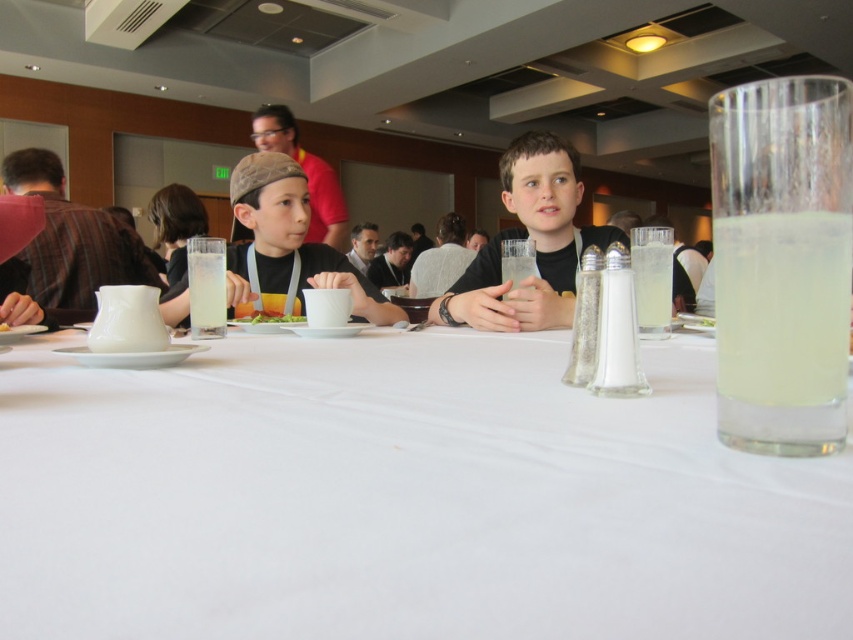
Does clear glass at center appear on the right side of green leafy salad at center?

Yes, clear glass at center is to the right of green leafy salad at center.

Is point (519, 243) farther from camera compared to point (276, 316)?

No, (519, 243) is in front of (276, 316).

Does point (514, 273) come in front of point (274, 320)?

Yes, point (514, 273) is in front of point (274, 320).

This screenshot has height=640, width=853. I want to click on clear glass at center, so click(517, 260).

Is clear glass at left to the right of green leafy salad at center from the viewer's perspective?

Incorrect, clear glass at left is not on the right side of green leafy salad at center.

The width and height of the screenshot is (853, 640). I want to click on clear glass at left, so click(x=206, y=294).

From the picture: Is clear glass at upper right thinner than clear glass at left?

Yes, clear glass at upper right is thinner than clear glass at left.

Between clear glass at upper right and clear glass at left, which one has more height?

clear glass at upper right

Locate an element on the screen. This screenshot has height=640, width=853. clear glass at upper right is located at coordinates (653, 288).